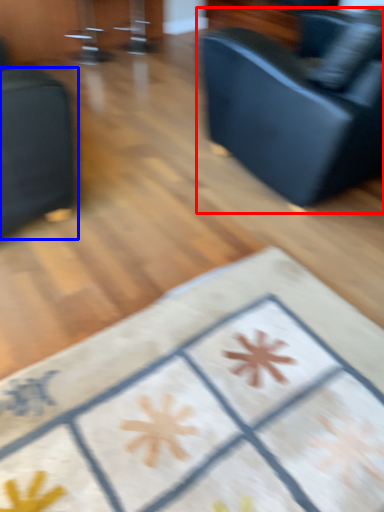
Question: Which object appears closest to the camera in this image, studio couch (highlighted by a red box) or furniture (highlighted by a blue box)?

Choices:
 (A) studio couch
 (B) furniture

Answer: (B)